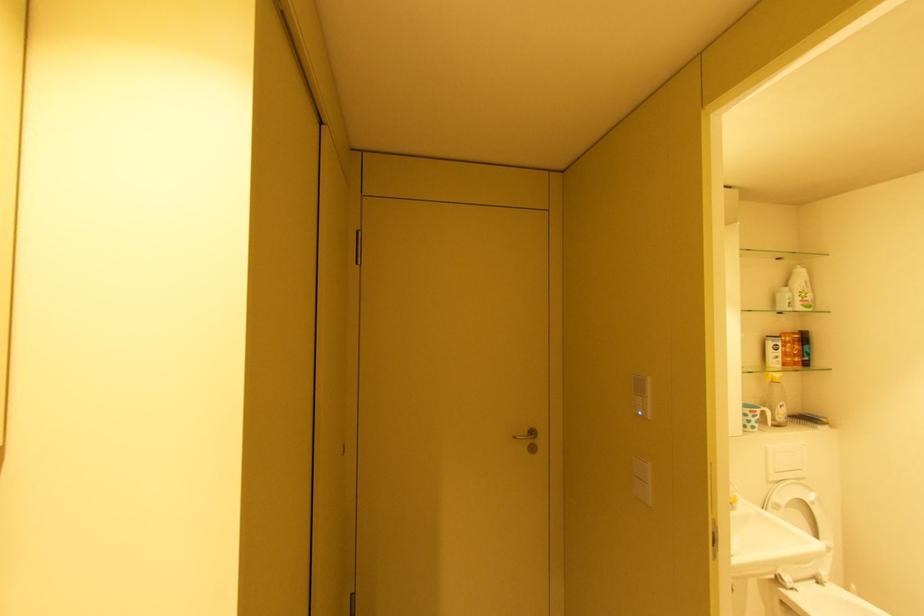
Where would you turn the metal door handle? Please return your answer as a coordinate pair (x, y).

(527, 435)